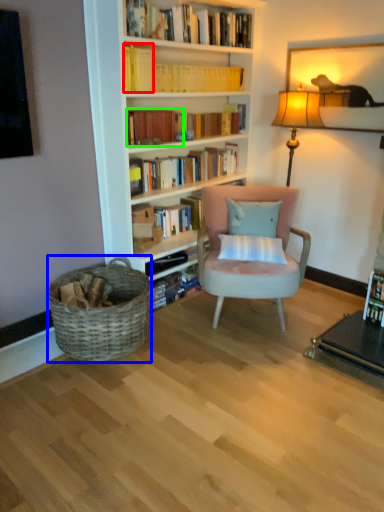
Question: Considering the real-world distances, which object is farthest from book (highlighted by a red box)? picnic basket (highlighted by a blue box) or book (highlighted by a green box)?

Choices:
 (A) picnic basket
 (B) book

Answer: (A)